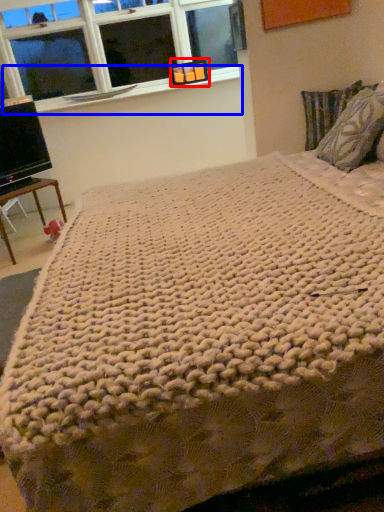
Question: Among these objects, which one is nearest to the camera, picture frame (highlighted by a red box) or window sill (highlighted by a blue box)?

Choices:
 (A) picture frame
 (B) window sill

Answer: (B)